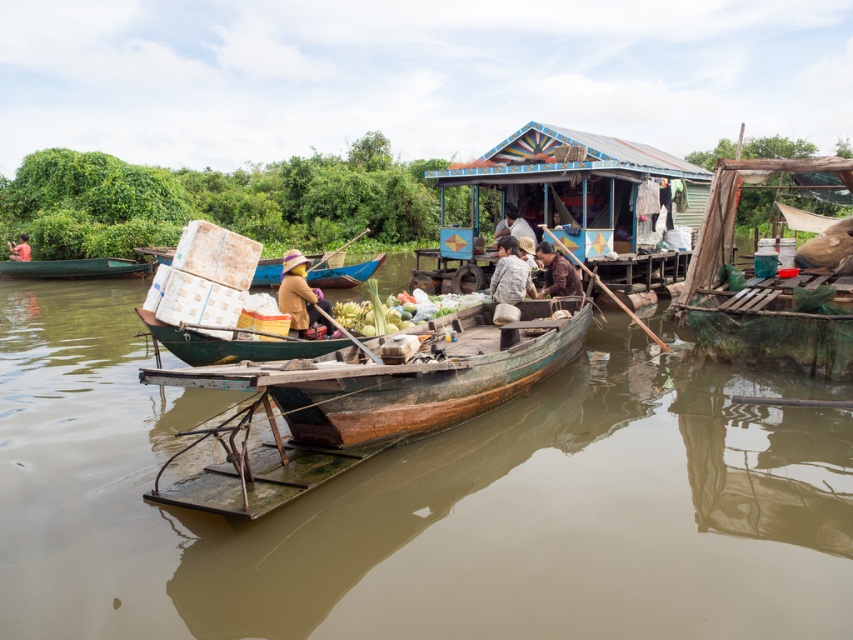
You are standing on the riverbank and see two canoes in the water. The green wooden canoe at left and the wooden canoe at center. Which one is positioned further to the left?

The green wooden canoe at left is positioned further to the left than the wooden canoe at center.

You are standing at the center of the image and want to reach the green tarpaulin boat at right. Which direction should you move to reach it?

The green tarpaulin boat at right is located at point 0.453 on the x axis and 0.891 on the y axis. Since you are at the center, moving towards the right and down would lead you to the green tarpaulin boat at right.

You are a tourist on a boat tour and need to take a photo of both the green wooden canoe at left and the wooden canoe at center. However, you notice that one of the canoes is blocking the view of the other. Which canoe is blocking the view of the other?

The green wooden canoe at left is positioned over wooden canoe at center, so the green wooden canoe at left is blocking the view of the wooden canoe at center.